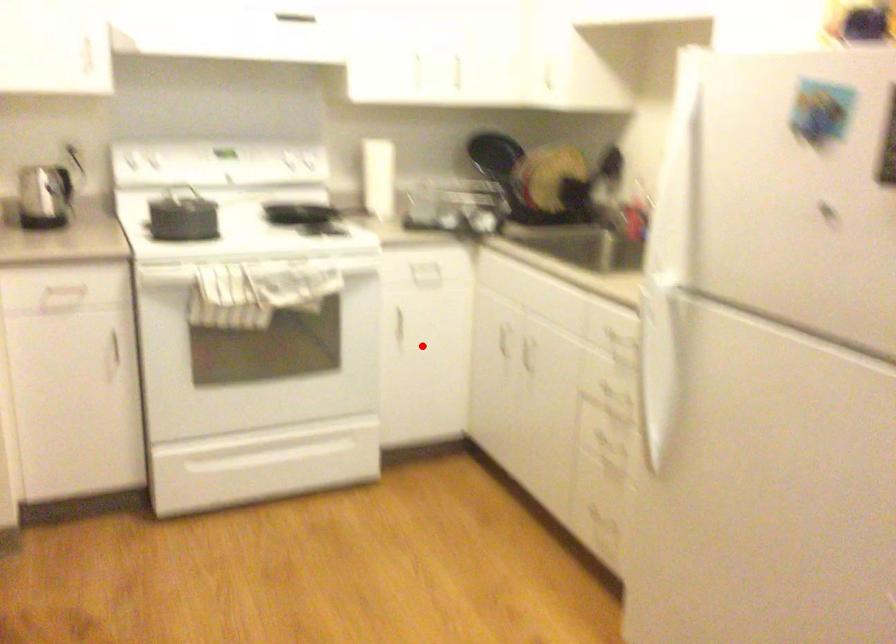
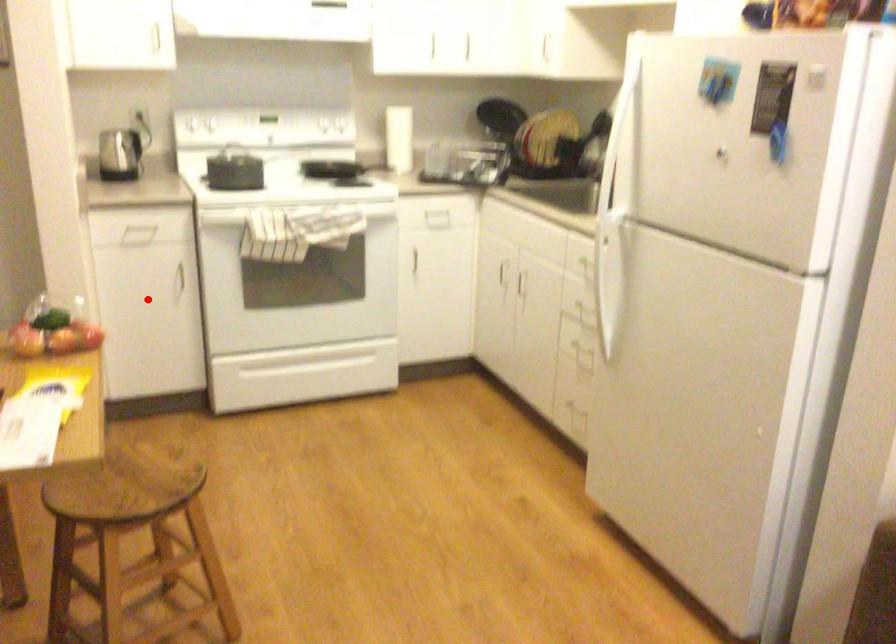
I am providing you with two images of the same scene from different viewpoints. A red point is marked on the first image and another point is marked on the second image. Does the point marked in image1 correspond to the same location as the one in image2?

No